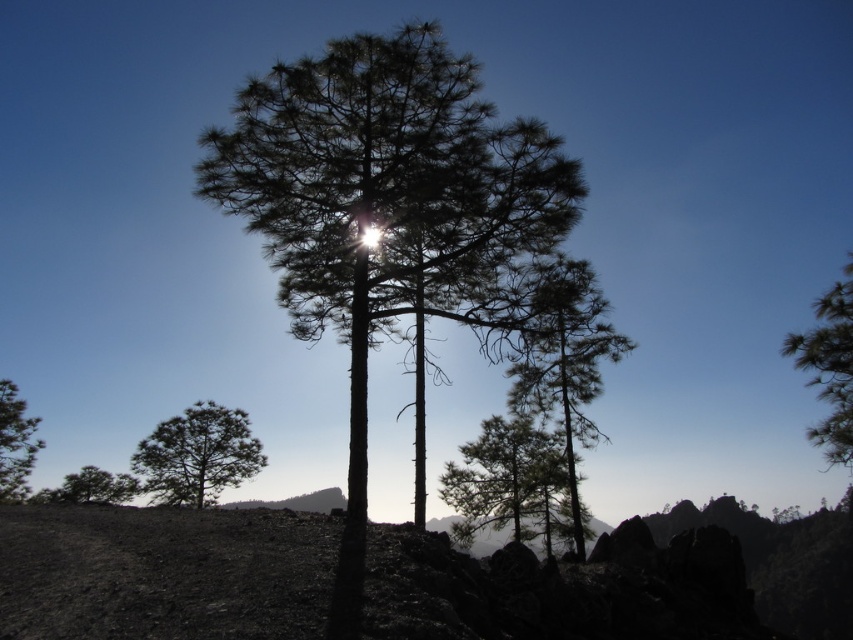
You are a hiker who wants to cross the rocky terrain in the foreground. You notice the burnt soil at lower left and the silhouette pine tree at lower left. Which of these two objects is bigger in size?

The burnt soil at lower left is larger in size than the silhouette pine tree at lower left, so the burnt soil at lower left is bigger.